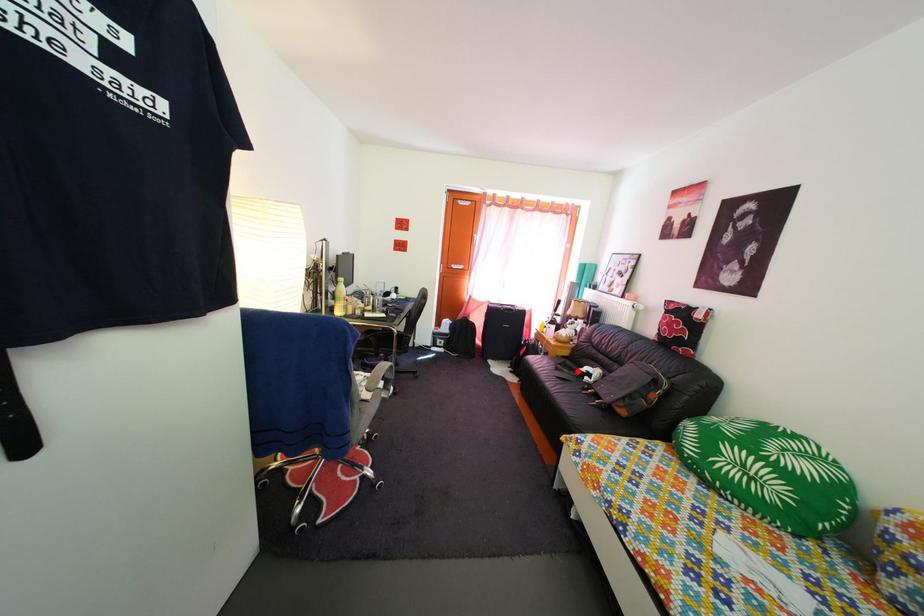
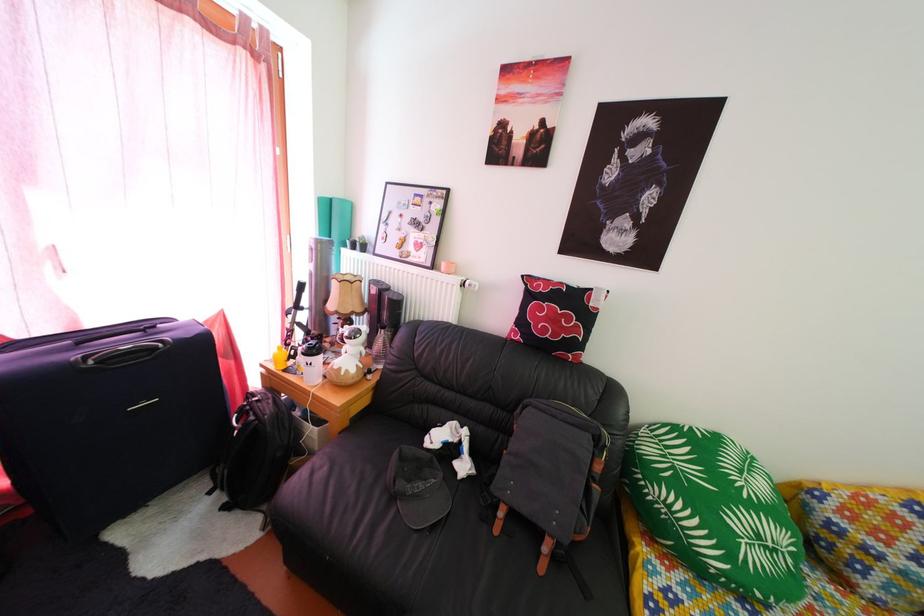
Question: I am providing you with two images of the same scene from different viewpoints. Given a red point in image1, look at the same physical point in image2. Is it:

Choices:
 (A) Closer to the viewpoint
 (B) Farther from the viewpoint

Answer: (B)